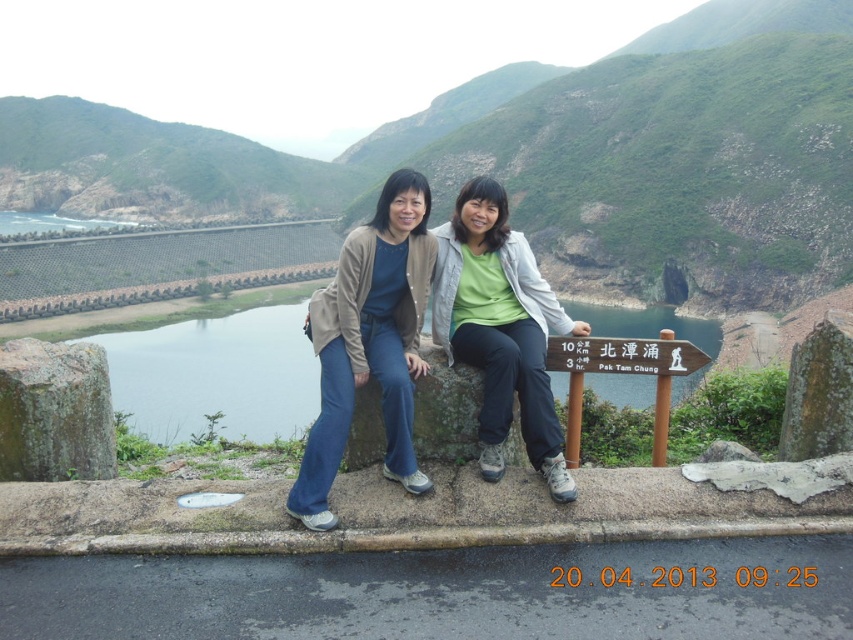
Question: Among these objects, which one is nearest to the camera?

Choices:
 (A) matte brown cardigan at center
 (B) green fabric jacket at center
 (C) green mossy rock at left
 (D) green grassy hillside at upper center

Answer: (A)

Question: Which of the following is the closest to the observer?

Choices:
 (A) (834, 381)
 (B) (488, 224)
 (C) (706, 337)
 (D) (77, 360)

Answer: (A)

Question: Does clear blue water at center have a larger size compared to brown wooden signpost at center?

Choices:
 (A) yes
 (B) no

Answer: (A)

Question: Is matte brown cardigan at center bigger than green mossy rock at left?

Choices:
 (A) no
 (B) yes

Answer: (B)

Question: Which point is farther from the camera taking this photo?

Choices:
 (A) (337, 269)
 (B) (578, 292)

Answer: (B)

Question: Can you confirm if green mossy rock at center is positioned to the left of brown wooden signpost at center?

Choices:
 (A) yes
 (B) no

Answer: (B)